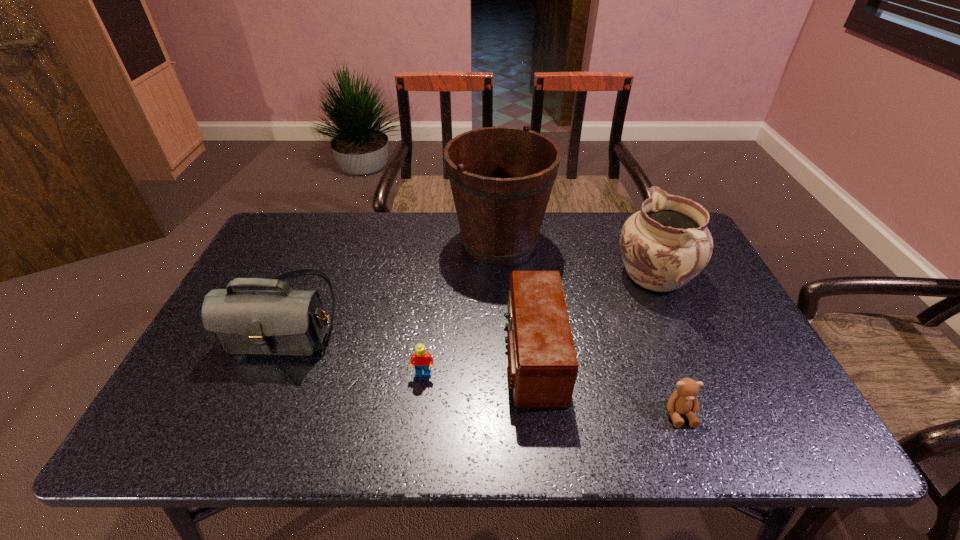
The width and height of the screenshot is (960, 540). Identify the location of free space located 0.280m on the right of the shoulder bag. (448, 314).

Where is `vacant space situated on the front-facing side of the radio receiver`? The height and width of the screenshot is (540, 960). vacant space situated on the front-facing side of the radio receiver is located at coordinates (383, 356).

Identify the location of vacant space located on the front-facing side of the radio receiver. The image size is (960, 540). (468, 356).

You are a GUI agent. You are given a task and a screenshot of the screen. Output one action in this format:
    pyautogui.click(x=<x>, y=<y>)
    Task: Click on the vacant region located on the front-facing side of the radio receiver
    This screenshot has height=540, width=960.
    Given the screenshot: What is the action you would take?
    pyautogui.click(x=447, y=356)

Where is `vacant region located 0.120m on the face of the Lego`? The width and height of the screenshot is (960, 540). vacant region located 0.120m on the face of the Lego is located at coordinates (418, 428).

This screenshot has width=960, height=540. Find the location of `bucket that is at the far edge`. bucket that is at the far edge is located at coordinates (501, 178).

Where is `pitcher present at the far edge`? The width and height of the screenshot is (960, 540). pitcher present at the far edge is located at coordinates (666, 244).

I want to click on object that is at the near edge, so click(682, 401).

Where is `object that is at the left edge`? object that is at the left edge is located at coordinates (276, 322).

The height and width of the screenshot is (540, 960). In order to click on object at the right edge in this screenshot , I will do `click(666, 244)`.